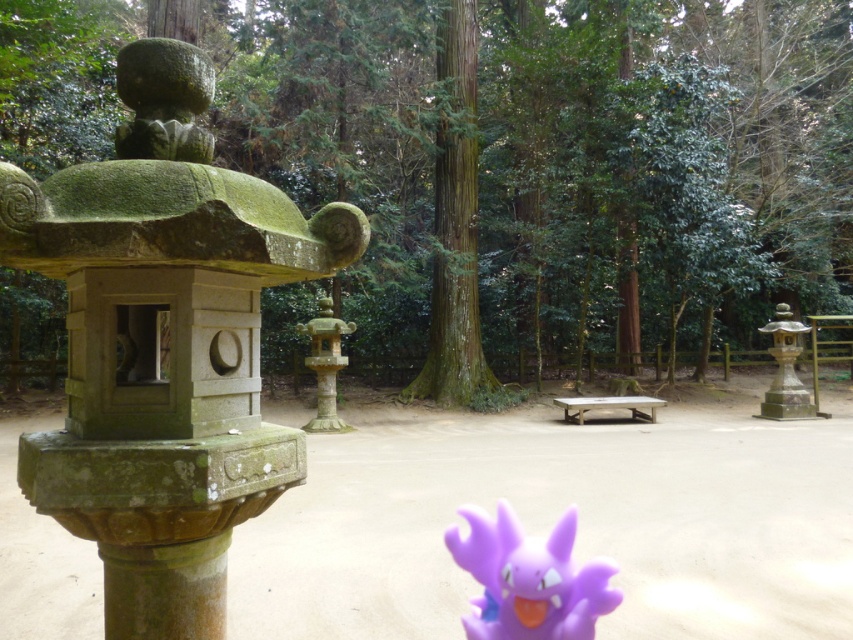
You are a gardener planning to place a new decorative pot that is 1 meter wide between the green mossy stone statue at upper left and the smooth stone lantern at center. Based on their sizes, will the space between them be sufficient to accommodate the pot?

The green mossy stone statue at upper left is narrower than the smooth stone lantern at center. However, the exact distance between them isn answer the question as the Objects Description only provides information about their widths, not the space between them. Therefore, it is impossible to determine if the space is sufficient based on the given information.

You are a visitor in the garden and want to place a small decoration between the purple plastic toy at center and the green mossy stone statue at upper left. Considering their sizes, which object should you place closer to the smaller one to maintain balance?

Since the purple plastic toy at center is wider than the green mossy stone statue at upper left, you should place the decoration closer to the green mossy stone statue at upper left to balance their sizes.